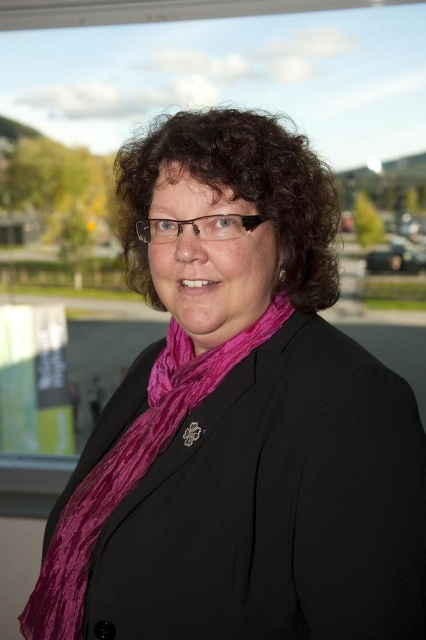
You are an artist sketching the person in the image. You want to draw the dark brown curly hair at center first. Where should you place it on your canvas using the coordinate system where the bottom left corner is the origin point? Please provide the coordinates as a tuple of two decimal numbers rounded to three decimal places.

The dark brown curly hair at center should be placed at coordinates approximately at point (238,193).

You are a fashion designer observing a model wearing a black blazer with a pink scarf and a brooch. You notice two items at the center of the image. Which item is shorter in height between the dark brown curly hair at center and the velvet purple scarf at center?

The dark brown curly hair at center is shorter in height than the velvet purple scarf at center.

You are an observer looking at the person in the image. Which object is positioned to the right of the other between the dark brown curly hair at center and the velvet purple scarf at center?

The dark brown curly hair at center is positioned to the right of the velvet purple scarf at center.